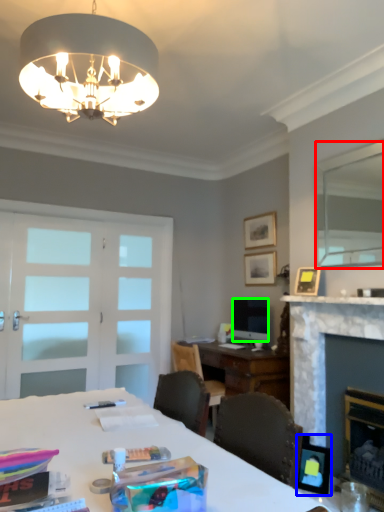
Question: Considering the real-world distances, which object is farthest from mirror (highlighted by a red box)? picture frame (highlighted by a blue box) or television (highlighted by a green box)?

Choices:
 (A) picture frame
 (B) television

Answer: (A)